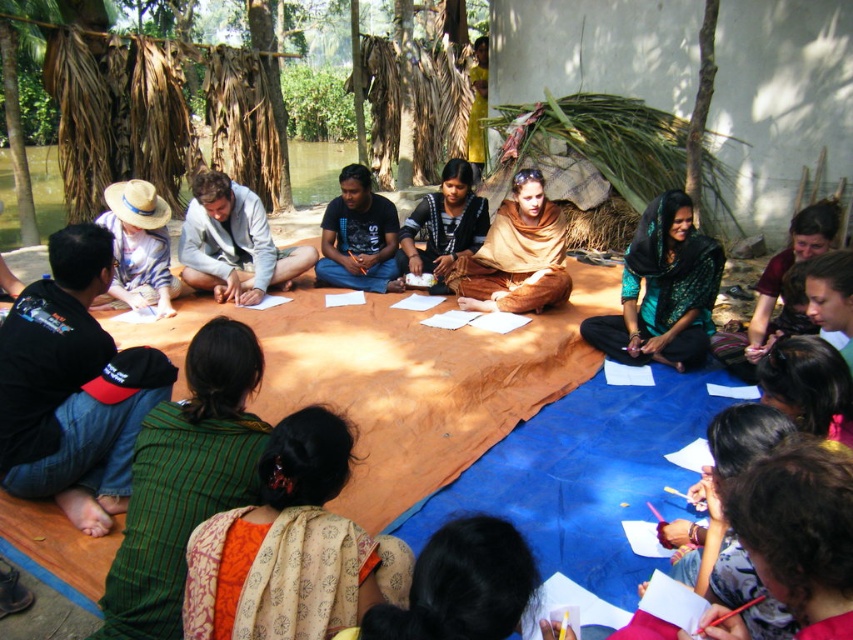
You are a photographer taking a picture of the group. You notice the green fabric shawl at center and the black cotton shirt at center. Which item should you focus on to ensure it is fully visible in the frame without cropping?

The green fabric shawl at center is not as tall as the black cotton shirt at center, so focusing on the black cotton shirt at center ensures it will be fully visible without cropping since it is taller.

Looking at the scene where people are gathered on the orange and blue tarps, can you tell me which object is positioned to the right of the other between the brown textured shawl at center and the brown woven cloth at center?

The brown textured shawl at center is positioned to the right of the brown woven cloth at center.

You are a photographer standing at the edge of the group. You want to take a photo that includes both the black cotton shirt at center and the brown woven cloth at center without any obstruction. Given that your camera has a maximum focus range of 15 inches, will you be able to capture both objects in focus simultaneously?

The black cotton shirt at center and brown woven cloth at center are 16.04 inches apart, which exceeds the camera maximum focus range of 15 inches. Therefore, you cannot capture both objects in focus simultaneously.